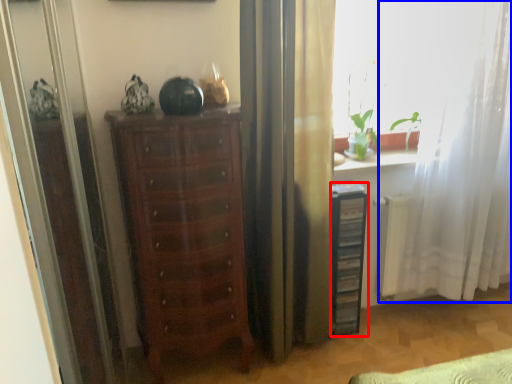
Question: Which point is further to the camera, file cabinet (highlighted by a red box) or curtain (highlighted by a blue box)?

Choices:
 (A) file cabinet
 (B) curtain

Answer: (A)